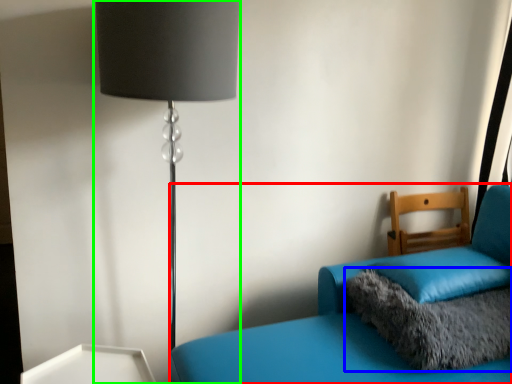
Question: Estimate the real-world distances between objects in this image. Which object is closer to furniture (highlighted by a red box), pillow (highlighted by a blue box) or lamp (highlighted by a green box)?

Choices:
 (A) pillow
 (B) lamp

Answer: (A)